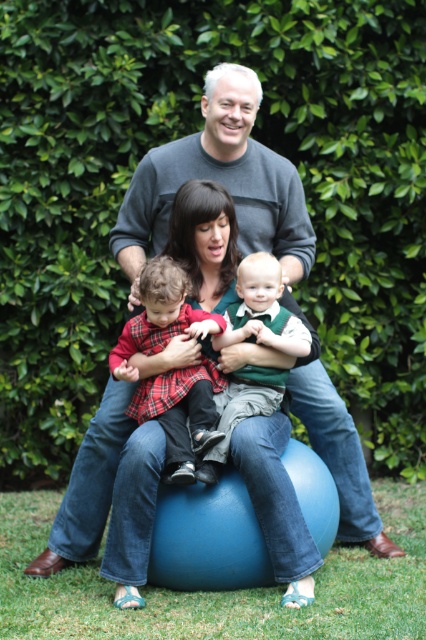
Is plaid fabric shirt at center to the right of green velvet vest at center from the viewer's perspective?

No, plaid fabric shirt at center is not to the right of green velvet vest at center.

Can you confirm if plaid fabric shirt at center is taller than green velvet vest at center?

Incorrect, plaid fabric shirt at center's height is not larger of green velvet vest at center's.

Between point (166, 380) and point (279, 378), which one is positioned behind?

Positioned behind is point (279, 378).

The width and height of the screenshot is (426, 640). Find the location of `plaid fabric shirt at center`. plaid fabric shirt at center is located at coordinates (181, 413).